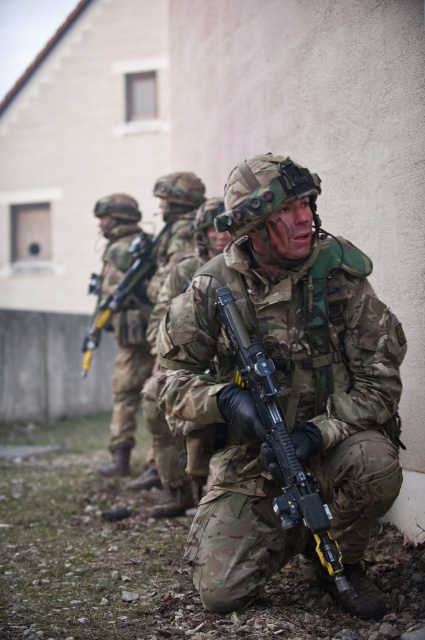
You are a member of the tactical team and need to identify the position of the camouflage fabric uniform at center relative to other elements in the scene. Based on the coordinates provided, can you determine if it is positioned centrally within the frame?

The camouflage fabric uniform at center is located at coordinates point (124,324), which is close to the center of the frame, so yes, it is positioned centrally within the frame.

You are a soldier in the formation and need to quickly grab your rifle. Based on the image, is the camouflage fabric rifle at center located to the left or right of your camouflage fabric uniform at center?

The camouflage fabric rifle at center is to the right of the camouflage fabric uniform at center, so you should reach to your right to grab it.